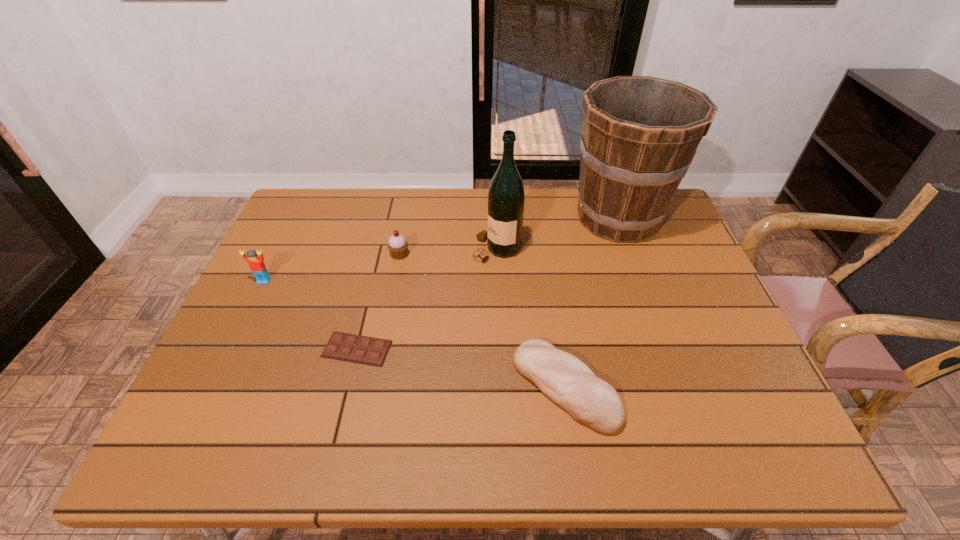
Locate an element on the screen. The height and width of the screenshot is (540, 960). vacant space at the far edge of the desktop is located at coordinates (534, 218).

Image resolution: width=960 pixels, height=540 pixels. What are the coordinates of `vacant space at the near edge` in the screenshot? It's located at (372, 444).

Where is `free space at the left edge of the desktop`? The image size is (960, 540). free space at the left edge of the desktop is located at coordinates (265, 300).

In the image, there is a desktop. Identify the location of free space at the right edge. (670, 235).

In the image, there is a desktop. Where is `vacant space at the far left corner`? This screenshot has width=960, height=540. vacant space at the far left corner is located at coordinates coord(332,232).

Where is `vacant area between the fifth tallest object and the cupcake`? The height and width of the screenshot is (540, 960). vacant area between the fifth tallest object and the cupcake is located at coordinates (482, 321).

You are a GUI agent. You are given a task and a screenshot of the screen. Output one action in this format:
    pyautogui.click(x=<x>, y=<y>)
    Task: Click on the vacant space that's between the fourth shortest object and the fourth tallest object
    This screenshot has height=540, width=960.
    Given the screenshot: What is the action you would take?
    pyautogui.click(x=332, y=268)

The height and width of the screenshot is (540, 960). Identify the location of vacant space that is in between the fifth tallest object and the shortest object. (461, 368).

At what (x,y) coordinates should I click in order to perform the action: click on empty space between the second shortest object and the third nearest object. Please return your answer as a coordinate pair (x, y). The height and width of the screenshot is (540, 960). Looking at the image, I should click on (415, 334).

In order to click on blank region between the shortest object and the bucket in this screenshot , I will do `click(488, 284)`.